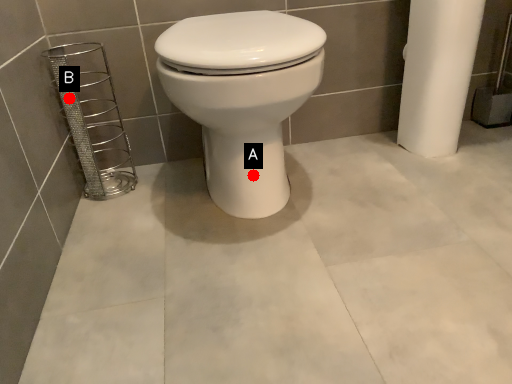
Question: Two points are circled on the image, labeled by A and B beside each circle. Which point is closer to the camera?

Choices:
 (A) A is closer
 (B) B is closer

Answer: (A)